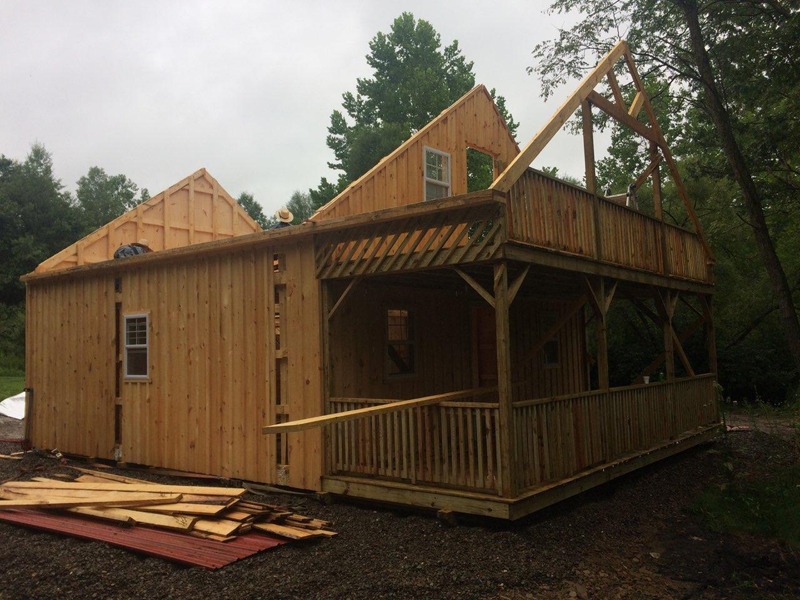
Locate an element on the screen. porch window is located at coordinates (546, 346), (397, 353).